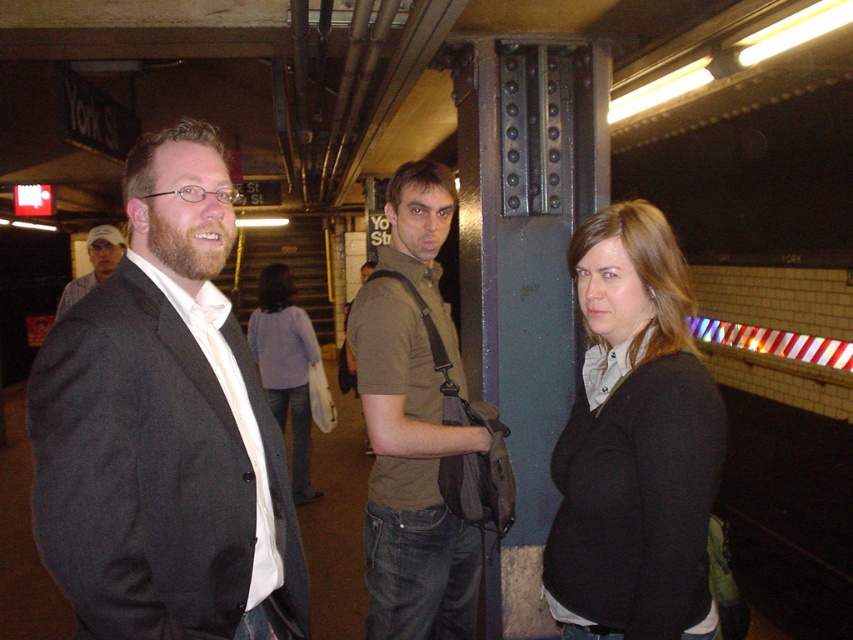
Question: Estimate the real-world distances between objects in this image. Which object is farther from the bearded man at left?

Choices:
 (A) black matte sweater at center
 (B) matte brown shirt at center
 (C) light purple sweater at center

Answer: (A)

Question: Estimate the real-world distances between objects in this image. Which object is farther from the bearded man at left?

Choices:
 (A) matte black suit at left
 (B) light purple sweater at center

Answer: (A)

Question: Which point is farther to the camera?

Choices:
 (A) (78, 426)
 (B) (585, 244)
 (C) (434, 486)
 (D) (97, 227)

Answer: (D)

Question: Is matte black suit at left behind bearded man at left?

Choices:
 (A) no
 (B) yes

Answer: (A)

Question: Can you confirm if black matte sweater at center is positioned above light purple sweater at center?

Choices:
 (A) no
 (B) yes

Answer: (B)

Question: Considering the relative positions of matte brown shirt at center and bearded man at left in the image provided, where is matte brown shirt at center located with respect to bearded man at left?

Choices:
 (A) left
 (B) right

Answer: (B)